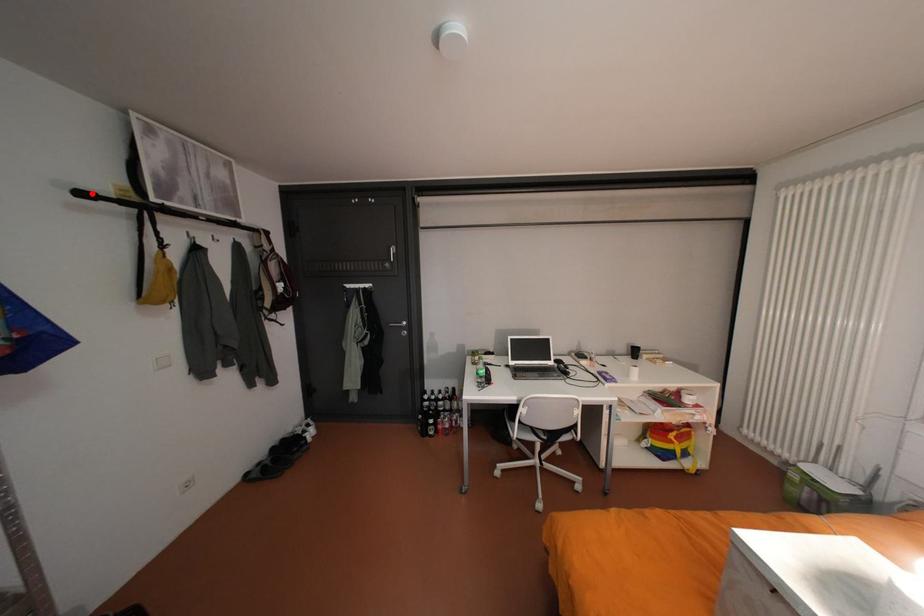
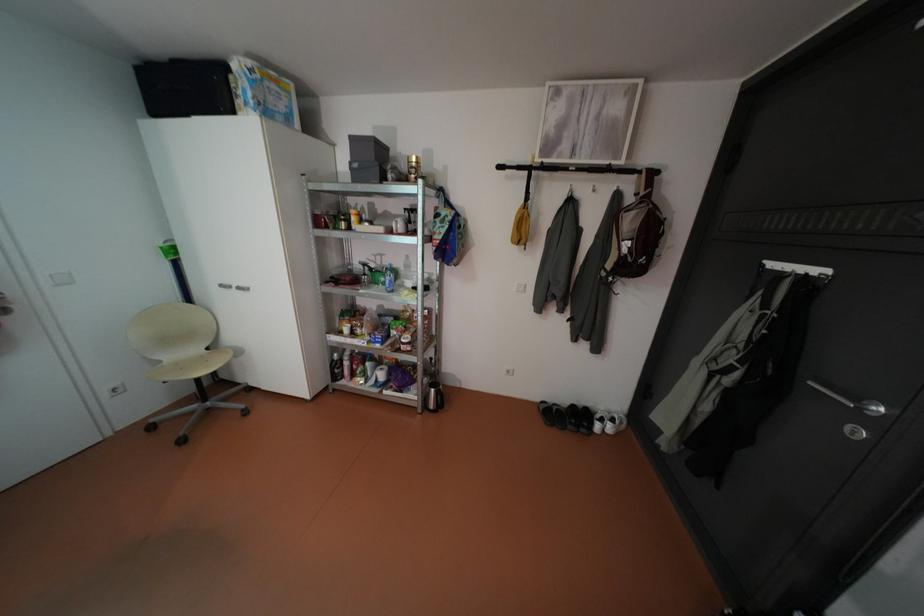
Question: I am providing you with two images of the same scene from different viewpoints. A red point is shown in image1. For the corresponding object point in image2, is it positioned nearer or farther from the camera?

Choices:
 (A) Nearer
 (B) Farther

Answer: (A)